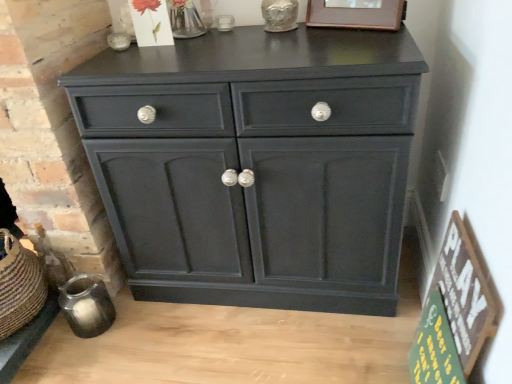
In order to click on vacant position to the left of wooden picture frame at upper center in this screenshot , I will do `click(298, 39)`.